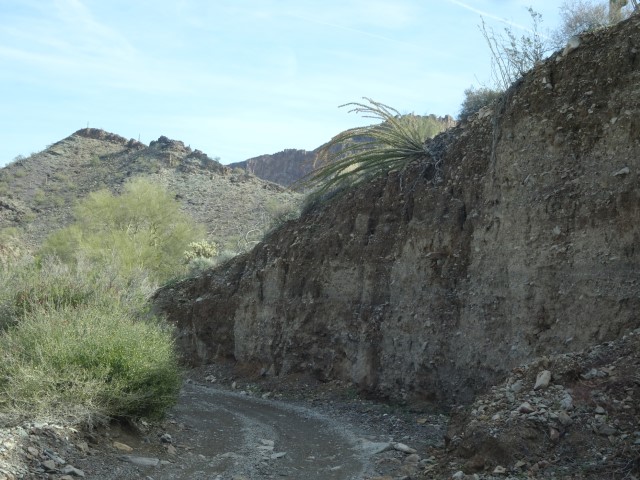
Where is `plants in bottom left`? plants in bottom left is located at coordinates (100, 358), (49, 291).